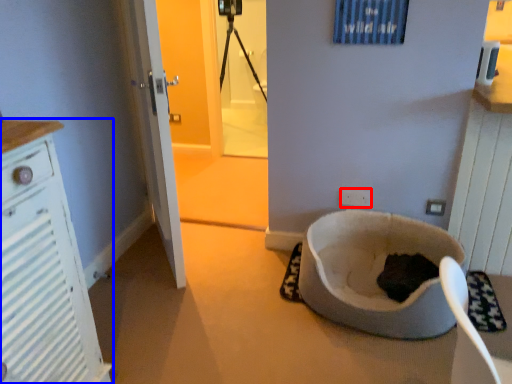
Question: Which point is closer to the camera, electric outlet (highlighted by a red box) or cabinetry (highlighted by a blue box)?

Choices:
 (A) electric outlet
 (B) cabinetry

Answer: (B)